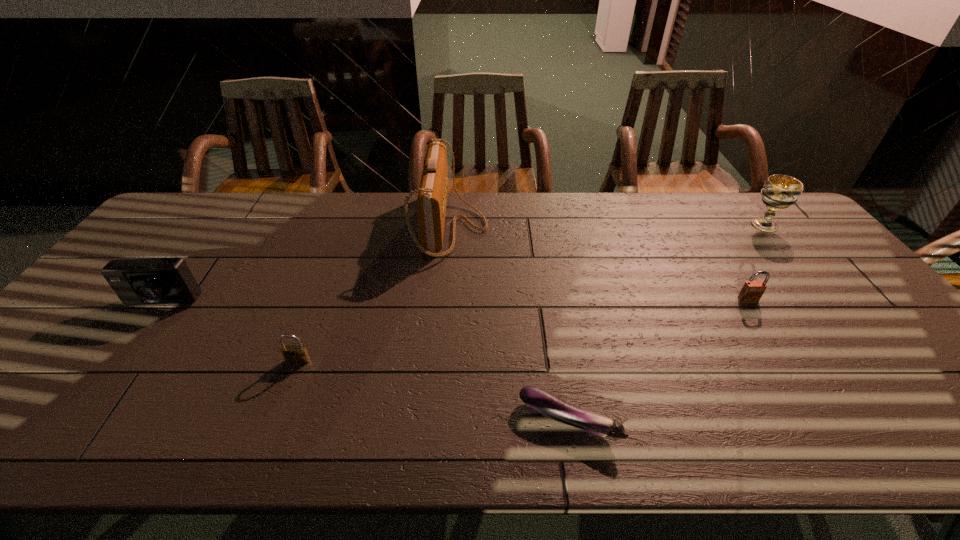
At what (x,y) coordinates should I click in order to perform the action: click on free space between the chalice and the eggplant. Please return your answer as a coordinate pair (x, y). Image resolution: width=960 pixels, height=540 pixels. Looking at the image, I should click on (666, 323).

This screenshot has width=960, height=540. Find the location of `free area in between the rightmost object and the fourth object from right to left`. free area in between the rightmost object and the fourth object from right to left is located at coordinates (608, 225).

I want to click on free space between the nearest object and the leftmost object, so click(x=365, y=362).

Image resolution: width=960 pixels, height=540 pixels. Find the location of `empty space that is in between the tallest object and the camera`. empty space that is in between the tallest object and the camera is located at coordinates (306, 265).

Locate an element on the screen. The height and width of the screenshot is (540, 960). empty space that is in between the right padlock and the second nearest object is located at coordinates (523, 330).

Locate an element on the screen. The image size is (960, 540). free space between the farther padlock and the third object from right to left is located at coordinates (659, 360).

Locate an element on the screen. free spot between the camera and the nearer padlock is located at coordinates click(x=229, y=332).

You are a GUI agent. You are given a task and a screenshot of the screen. Output one action in this format:
    pyautogui.click(x=<x>, y=<y>)
    Task: Click on the unoccupied area between the rightmost object and the fifth object from right to left
    
    Given the screenshot: What is the action you would take?
    pyautogui.click(x=531, y=293)

The height and width of the screenshot is (540, 960). I want to click on object that is the fourth nearest to the third tallest object, so click(x=752, y=291).

At what (x,y) coordinates should I click in order to perform the action: click on the fifth closest object relative to the leftmost object. Please return your answer as a coordinate pair (x, y). The width and height of the screenshot is (960, 540). Looking at the image, I should click on (779, 192).